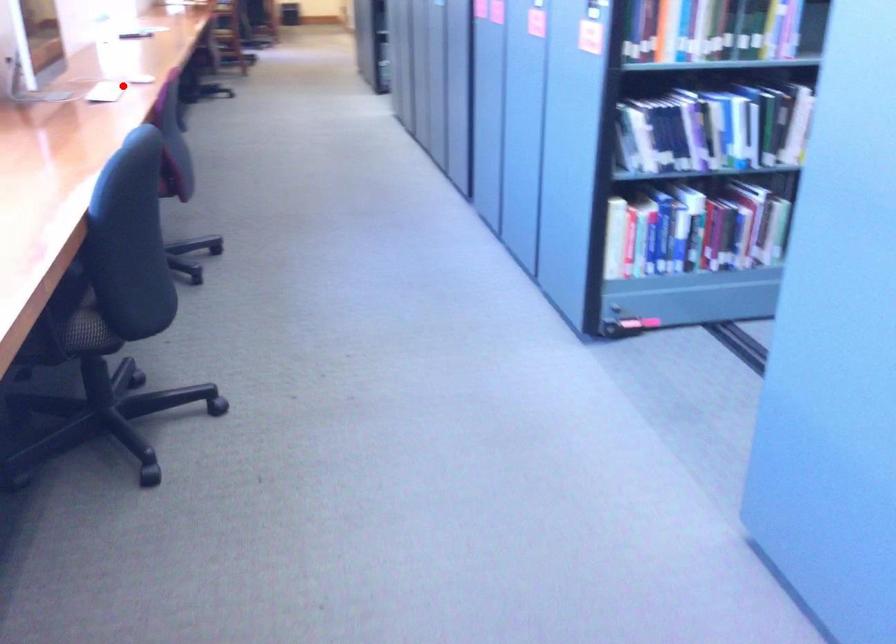
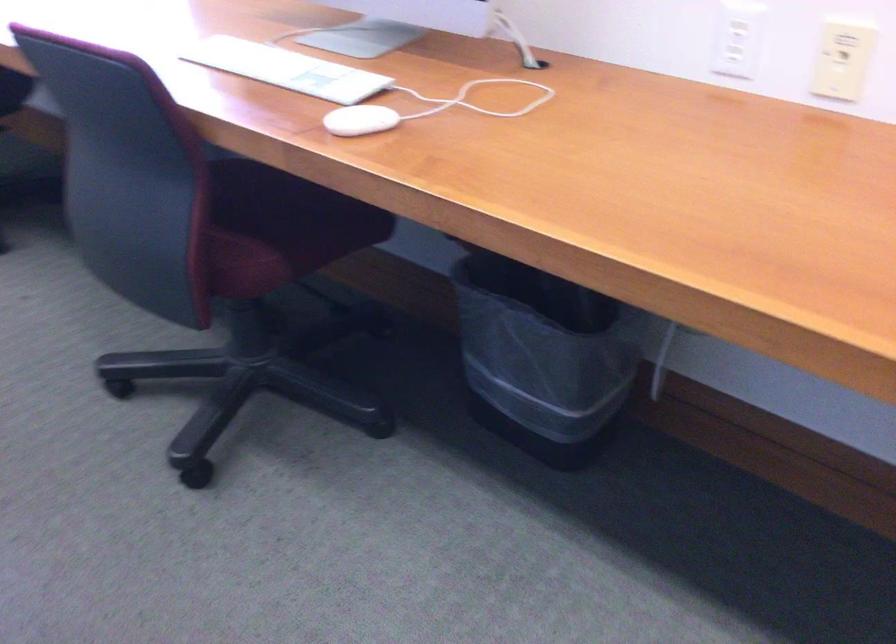
Where in the second image is the point corresponding to the highlighted location from the first image?

(286, 69)